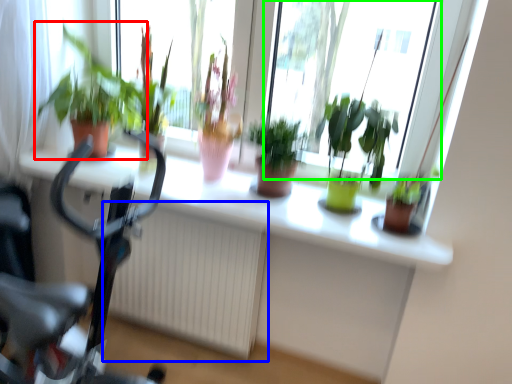
Question: Which is nearer to the houseplant (highlighted by a red box)? radiator (highlighted by a blue box) or bay window (highlighted by a green box).

Choices:
 (A) radiator
 (B) bay window

Answer: (A)